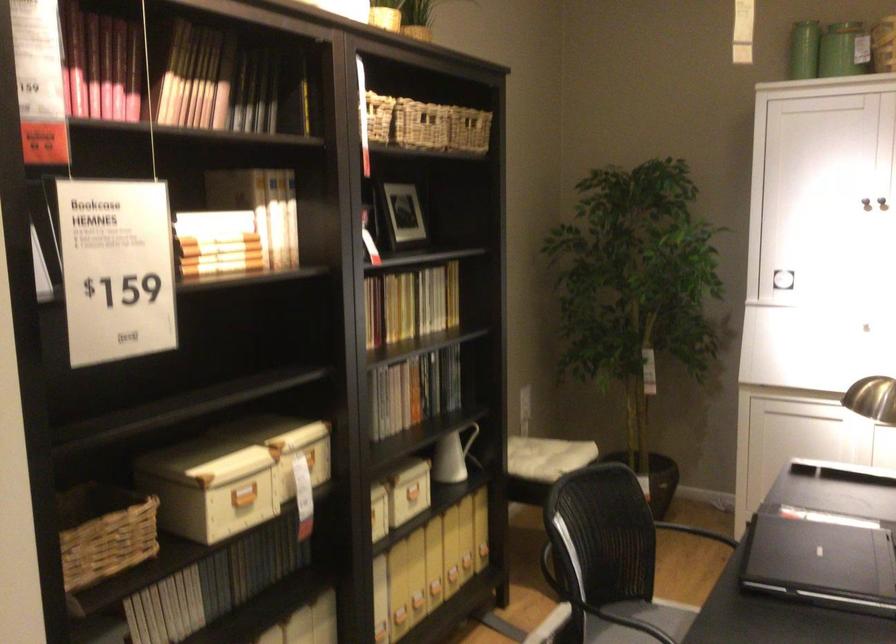
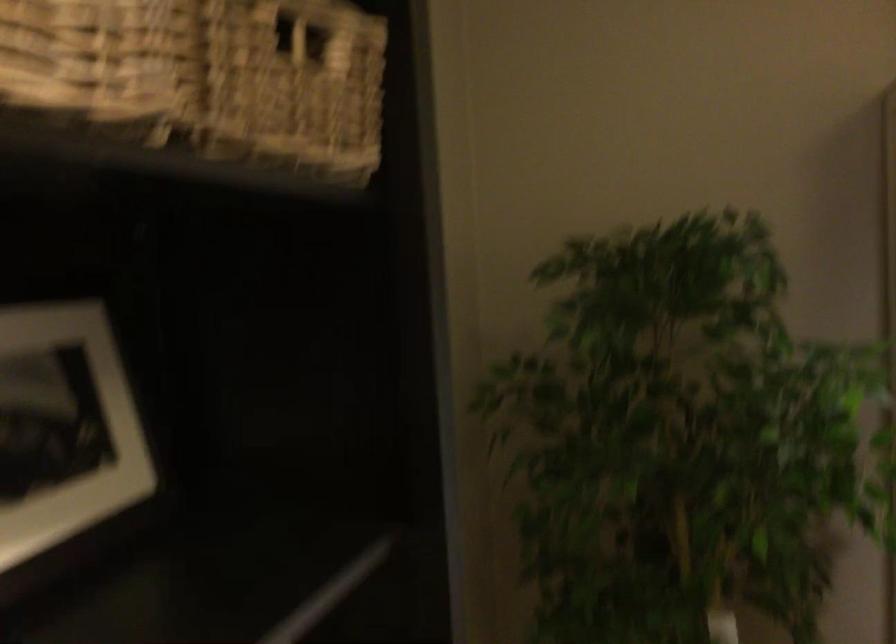
Where in the second image is the point corresponding to the point at 401,216 from the first image?

(64, 427)